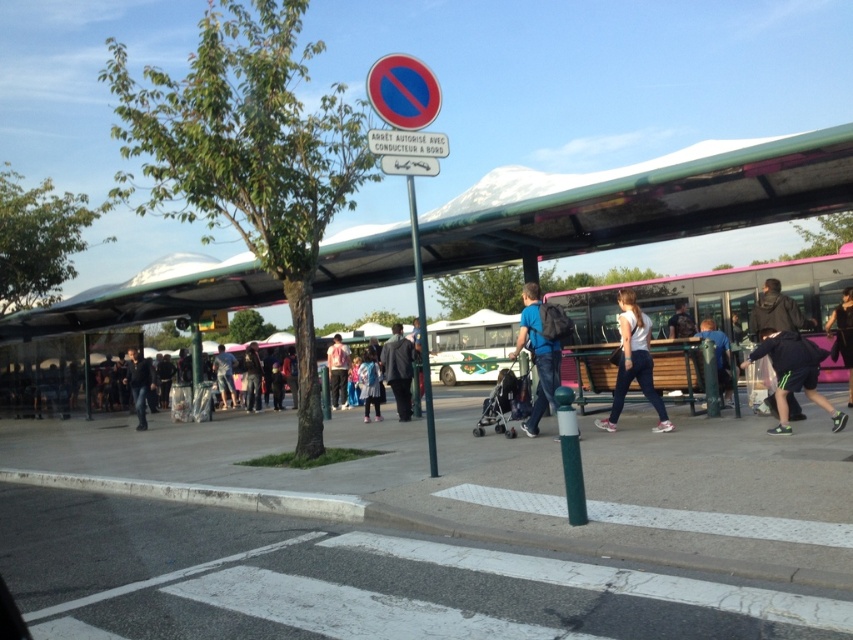
Based on the photo, you are standing at the bus stop and want to walk to the pedestrian crossing. The bus stop is under the covered shelter. According to the image, where is the gray asphalt at lower center located in relation to the pedestrian crossing? Please provide coordinates in the format of a point like this example format of point format like point format like point format like point format like point format like point format like point format like point format like point format like point format like point format like

The gray asphalt at lower center is located at point point point point point point point point point point point point point point point point point point point point point point point point point point point point point point point point point point point point point point point point point point point point point point point point point point point point point point point point point point point point point point point point point point point point point point point point point point point point point

You are a delivery person carrying a package that requires a 30 feet clearance to maneuver safely. You need to move from the red plastic sign at upper center to the dark blue jeans at lower left. Can you navigate this path without any obstructions?

The distance between the red plastic sign at upper center and the dark blue jeans at lower left is 40.92 feet, which is more than the required 30 feet clearance. Therefore, you can safely navigate the path without any obstructions.

You are a delivery drone flying over the bus stop scene. You need to drop off a package at the red plastic sign at upper center. What are the coordinates to navigate to?

The coordinates for the red plastic sign at upper center are at point (403,92).